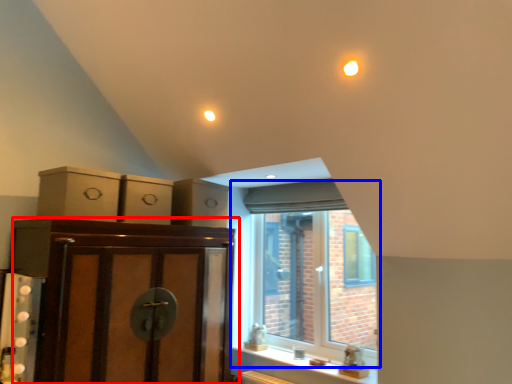
Question: Which of the following is the farthest to the observer, cabinetry (highlighted by a red box) or window (highlighted by a blue box)?

Choices:
 (A) cabinetry
 (B) window

Answer: (B)